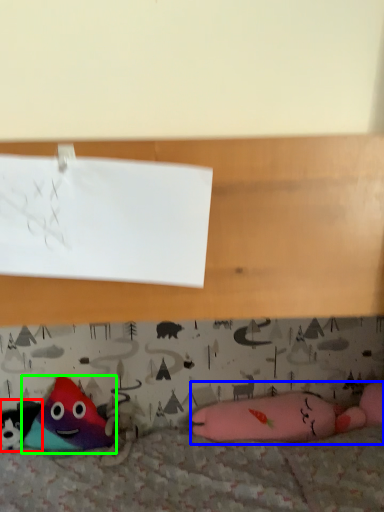
Question: Which object is positioned farthest from toy (highlighted by a red box)? Select from toy (highlighted by a blue box) and toy (highlighted by a green box).

Choices:
 (A) toy
 (B) toy

Answer: (A)